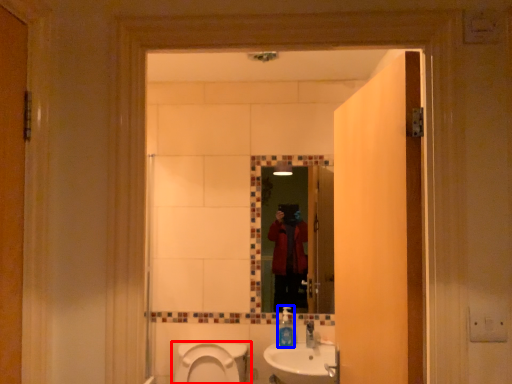
Question: Among these objects, which one is farthest to the camera, toilet (highlighted by a red box) or soap dispenser (highlighted by a blue box)?

Choices:
 (A) toilet
 (B) soap dispenser

Answer: (B)